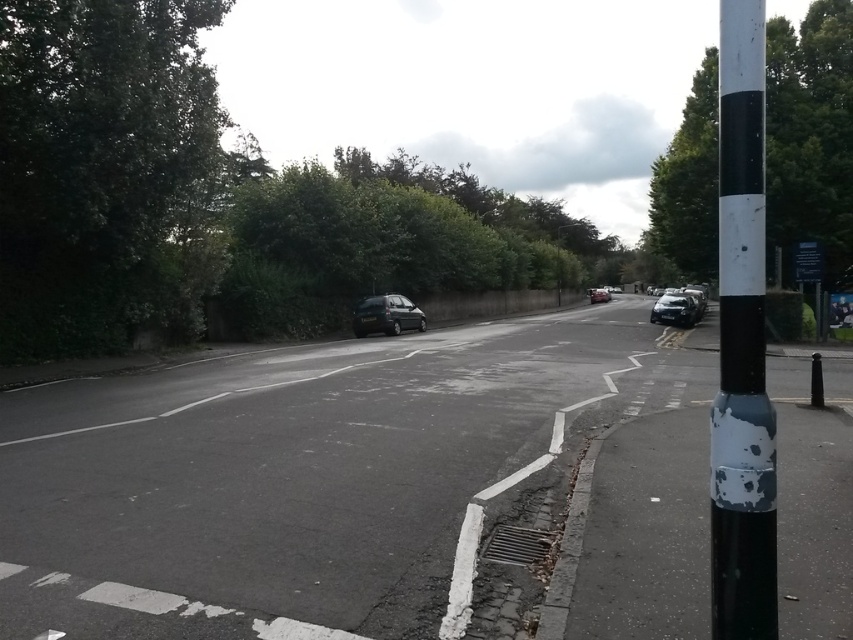
You are a pedestrian standing at the edge of the road near the green leafy tree at upper left. You want to cross the road to reach the other side where the shiny black car at center is parked. The road is 10 meters wide. Can you safely cross the road without needing to walk more than 12 meters?

The distance between the green leafy tree at upper left and the shiny black car at center is 7.40 meters. Since the road is 10 meters wide, you would need to walk 10 meters to cross. Since 10 meters is less than 12 meters, you can safely cross the road without exceeding the 12 meter limit.

You are standing at the point with coordinates (810, 132) in the image. What object are you currently standing on?

You are standing on the green leafy tree at right.

You are a delivery robot navigating an urban street. You need to move from your current position to a delivery point located at point (x=170, y=216). However, there is an obstacle at point (x=508, y=538) blocking your path. Can you safely navigate around the obstacle to reach your destination?

Point (x=508, y=538) is in front of point (x=170, y=216), so the obstacle is blocking the direct path. You will need to navigate around it to reach the delivery point.